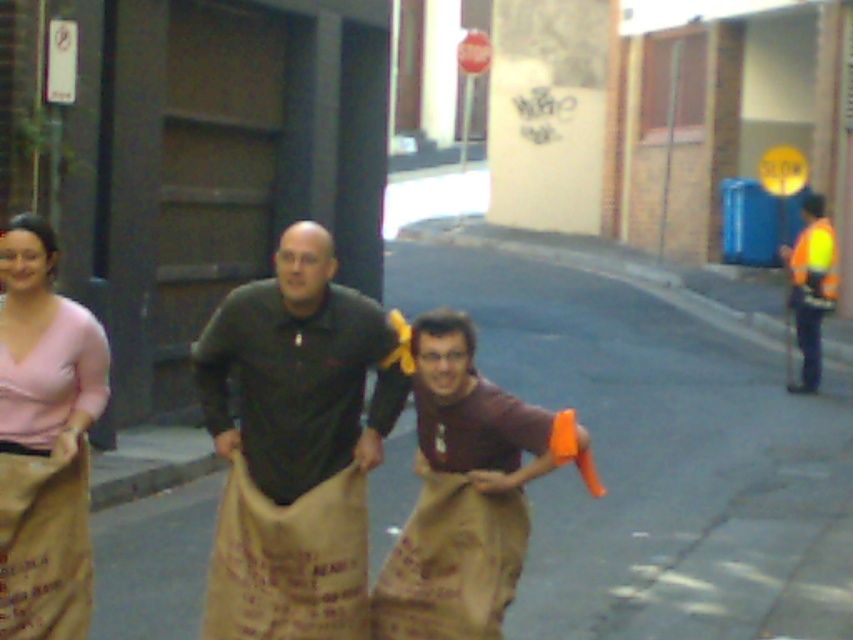
Question: Is burlap sack at center thinner than high-visibility reflective vest at right?

Choices:
 (A) no
 (B) yes

Answer: (B)

Question: Which of the following is the farthest from the observer?

Choices:
 (A) burlap sack at center
 (B) matte pink sweater at left
 (C) high-visibility reflective vest at right
 (D) matte black shirt at center

Answer: (C)

Question: Which of the following is the farthest from the observer?

Choices:
 (A) (97, 323)
 (B) (827, 230)
 (C) (463, 561)
 (D) (527, 406)

Answer: (B)

Question: Can you confirm if burlap sack at center is thinner than matte black shirt at center?

Choices:
 (A) no
 (B) yes

Answer: (A)

Question: Is matte pink sweater at left bigger than high-visibility reflective vest at right?

Choices:
 (A) yes
 (B) no

Answer: (B)

Question: Among these objects, which one is nearest to the camera?

Choices:
 (A) brown paper sack at center
 (B) matte pink sweater at left
 (C) high-visibility reflective vest at right

Answer: (A)